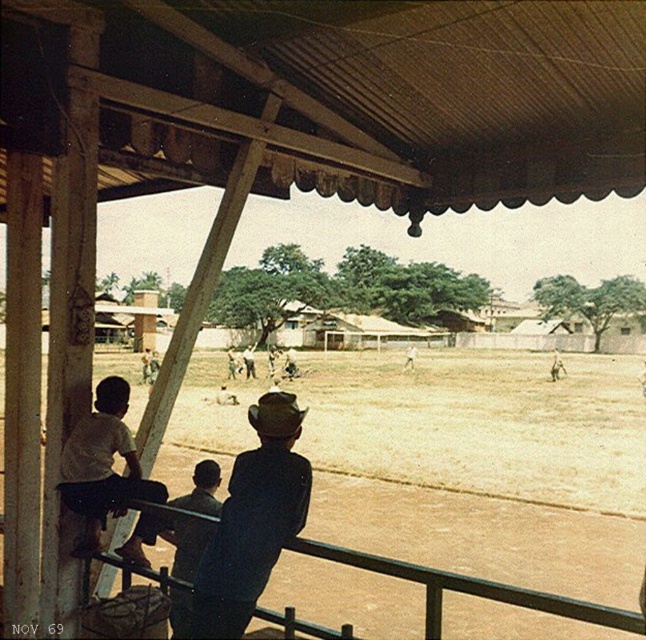
Question: Which of these objects is positioned closest to the dark blue shirt at center?

Choices:
 (A) brown sandy ground at center
 (B) brown corrugated metal at upper center

Answer: (B)

Question: Which object appears closest to the camera in this image?

Choices:
 (A) dark blue denim jacket at center
 (B) white matte shirt at left

Answer: (A)

Question: Is brown sandy ground at center to the right of white matte shirt at left from the viewer's perspective?

Choices:
 (A) no
 (B) yes

Answer: (B)

Question: Is brown corrugated metal at upper center above dark blue shirt at center?

Choices:
 (A) yes
 (B) no

Answer: (A)

Question: Can you confirm if brown corrugated metal at upper center is positioned to the left of brown sandy ground at center?

Choices:
 (A) yes
 (B) no

Answer: (B)

Question: Which is farther from the dark blue denim jacket at center?

Choices:
 (A) dark blue shirt at center
 (B) white matte shirt at left
 (C) brown sandy ground at center

Answer: (C)